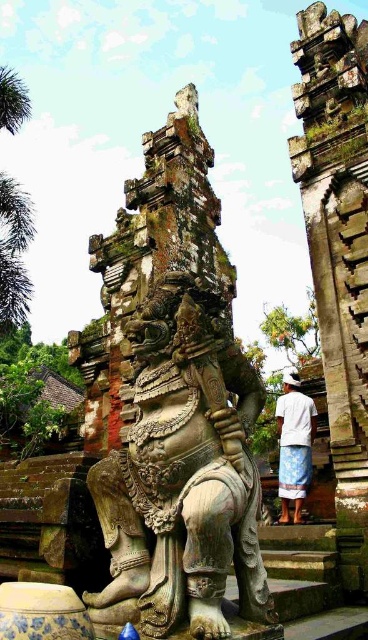
Question: Which point is closer to the camera?

Choices:
 (A) (281, 394)
 (B) (161, 282)

Answer: (B)

Question: Among these objects, which one is nearest to the camera?

Choices:
 (A) green leafy palm tree at left
 (B) carved stone statue at center
 (C) green leafy palm tree at upper left

Answer: (B)

Question: Among these points, which one is nearest to the camera?

Choices:
 (A) (19, 310)
 (B) (12, 90)

Answer: (A)

Question: Is green leafy palm tree at left positioned in front of white woven cloth at center?

Choices:
 (A) yes
 (B) no

Answer: (B)

Question: Is carved stone pillar at right to the left of green leafy palm tree at upper left from the viewer's perspective?

Choices:
 (A) no
 (B) yes

Answer: (A)

Question: Does green leafy palm tree at left appear over white woven cloth at center?

Choices:
 (A) no
 (B) yes

Answer: (B)